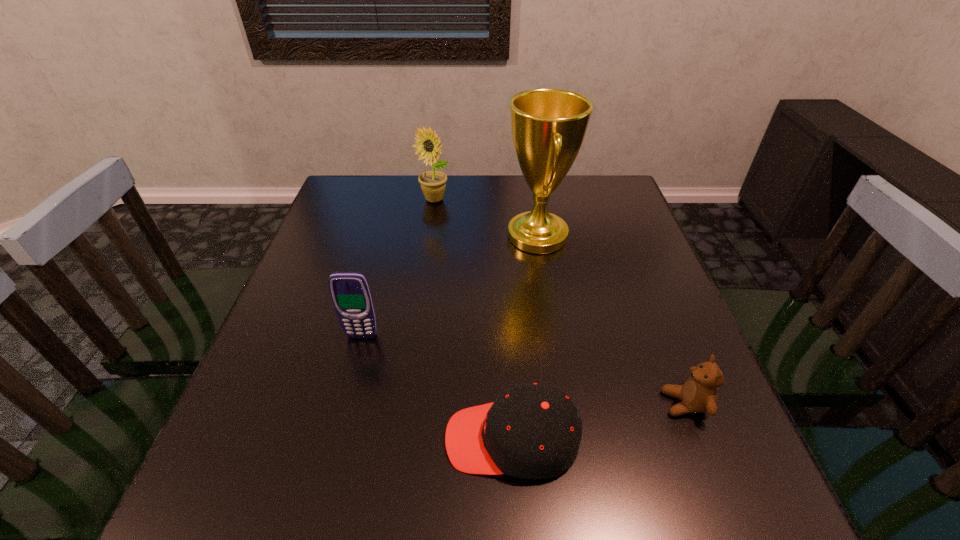
Identify the location of vacant region located on the face of the second object from left to right. Image resolution: width=960 pixels, height=540 pixels. (429, 230).

Locate an element on the screen. The height and width of the screenshot is (540, 960). vacant position located 0.240m on the front-facing side of the third tallest object is located at coordinates (332, 450).

You are a GUI agent. You are given a task and a screenshot of the screen. Output one action in this format:
    pyautogui.click(x=<x>, y=<y>)
    Task: Click on the vacant space located on the front-facing side of the rightmost object
    
    Given the screenshot: What is the action you would take?
    pyautogui.click(x=493, y=403)

The image size is (960, 540). Identify the location of free spot located 0.080m on the front-facing side of the rightmost object. (620, 403).

This screenshot has width=960, height=540. Identify the location of free space located 0.320m on the front-facing side of the rightmost object. (488, 403).

Where is `free location located on the front-facing side of the cap`? The width and height of the screenshot is (960, 540). free location located on the front-facing side of the cap is located at coordinates (327, 439).

I want to click on vacant point located 0.170m on the front-facing side of the cap, so click(x=346, y=439).

I want to click on blank area located on the front-facing side of the cap, so click(x=410, y=439).

The height and width of the screenshot is (540, 960). In order to click on award located at the far edge in this screenshot , I will do `click(548, 126)`.

Identify the location of sunflower located at the far edge. (433, 183).